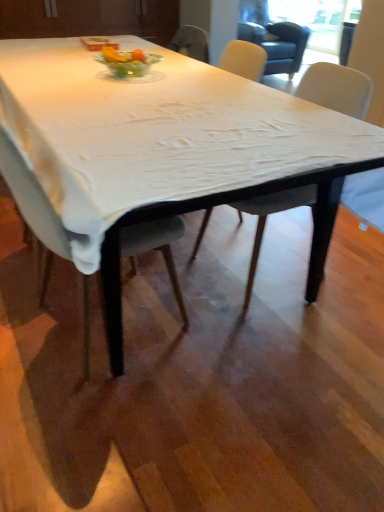
You are a GUI agent. You are given a task and a screenshot of the screen. Output one action in this format:
    pyautogui.click(x=<x>, y=<y>)
    Task: Click on the vacant area that lies in front of clear glass bowl at center
    
    Given the screenshot: What is the action you would take?
    pyautogui.click(x=119, y=89)